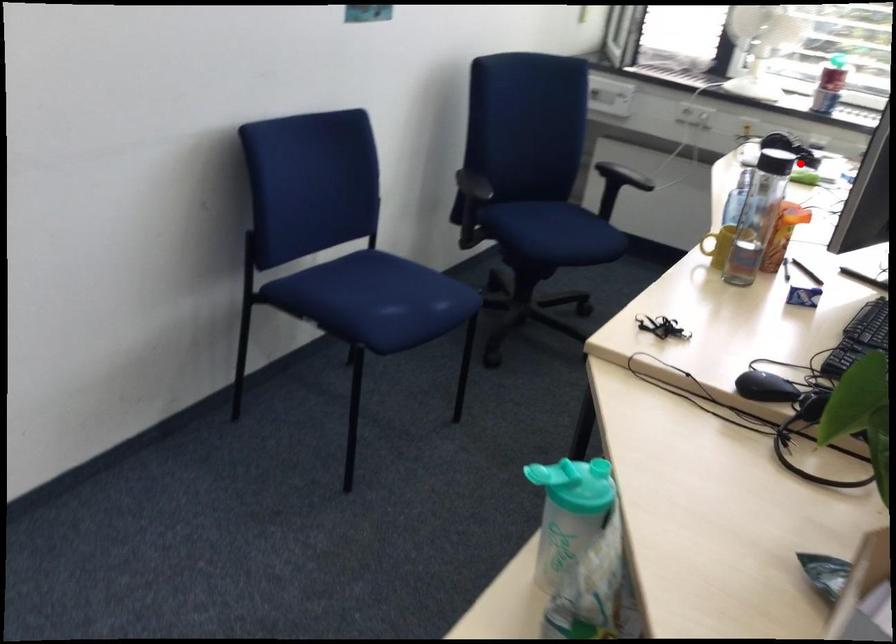
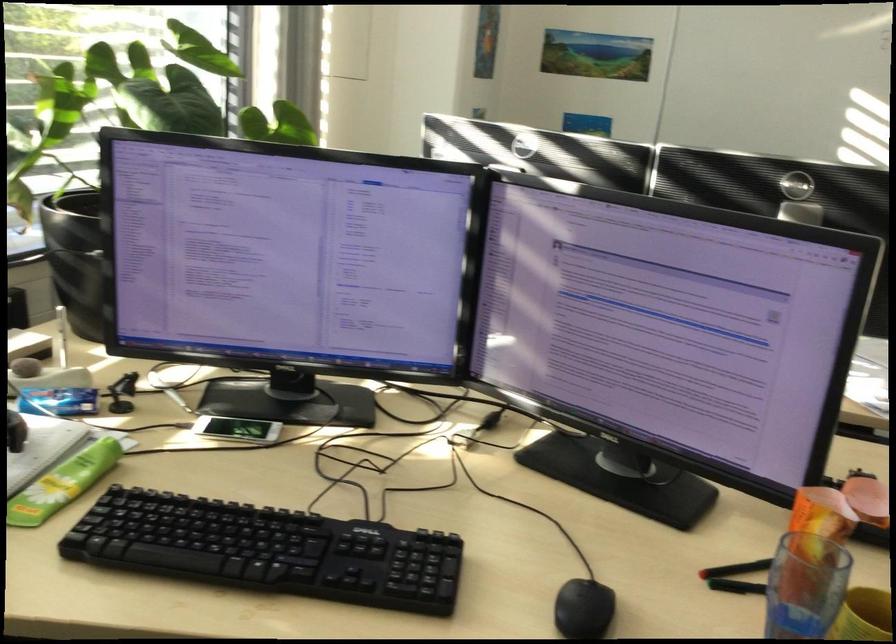
The point at the highlighted location is marked in the first image. Where is the corresponding point in the second image?

(64, 483)